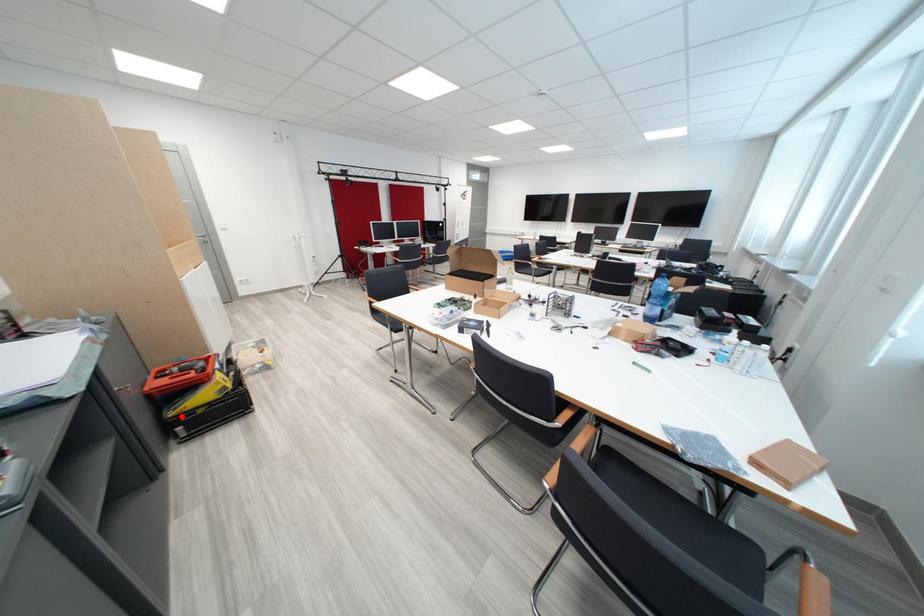
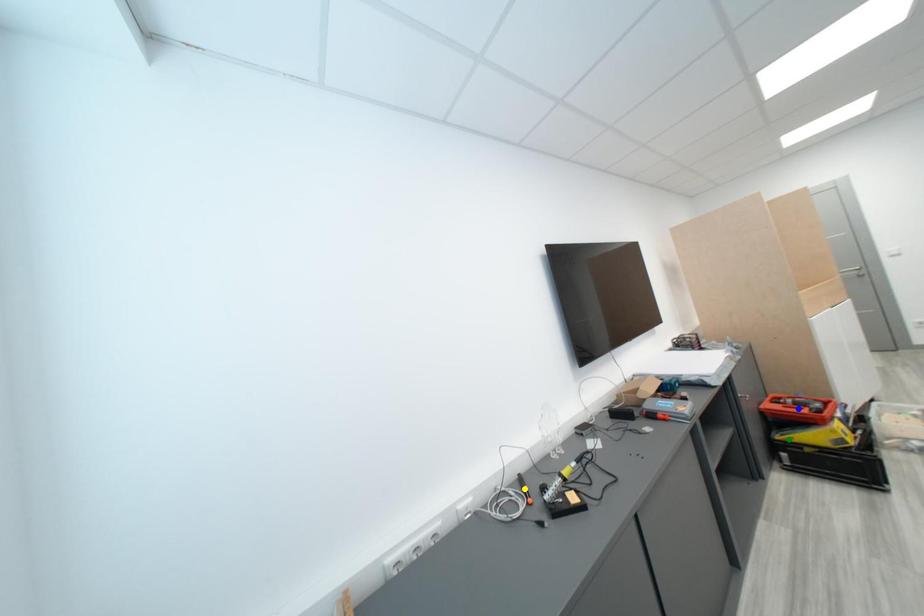
Question: I am providing you with two images of the same scene from different viewpoints. A red point is marked on the first image. You are given multiple points on the second image. Can you choose the point in image 2 that corresponds to the point in image 1?

Choices:
 (A) green point
 (B) blue point
 (C) yellow point

Answer: (A)